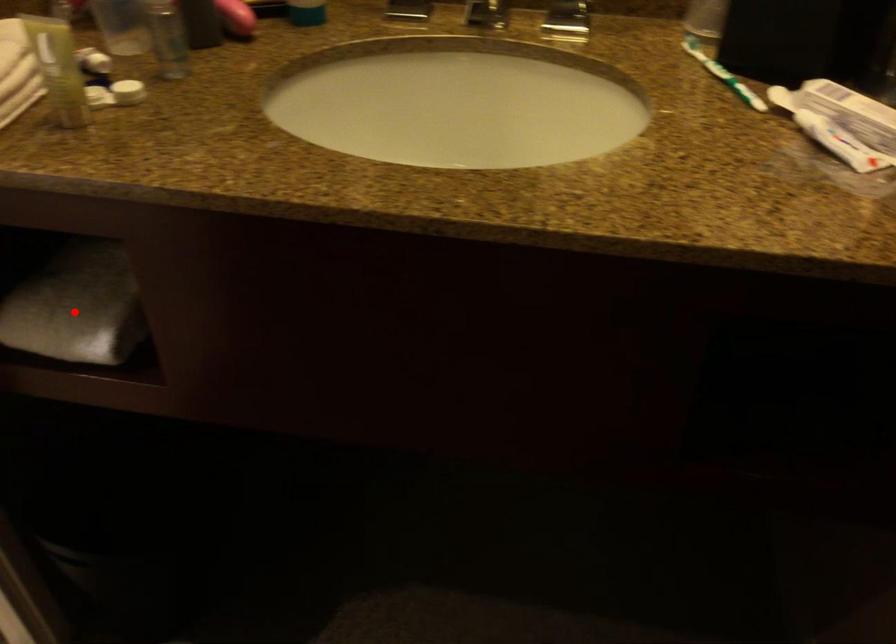
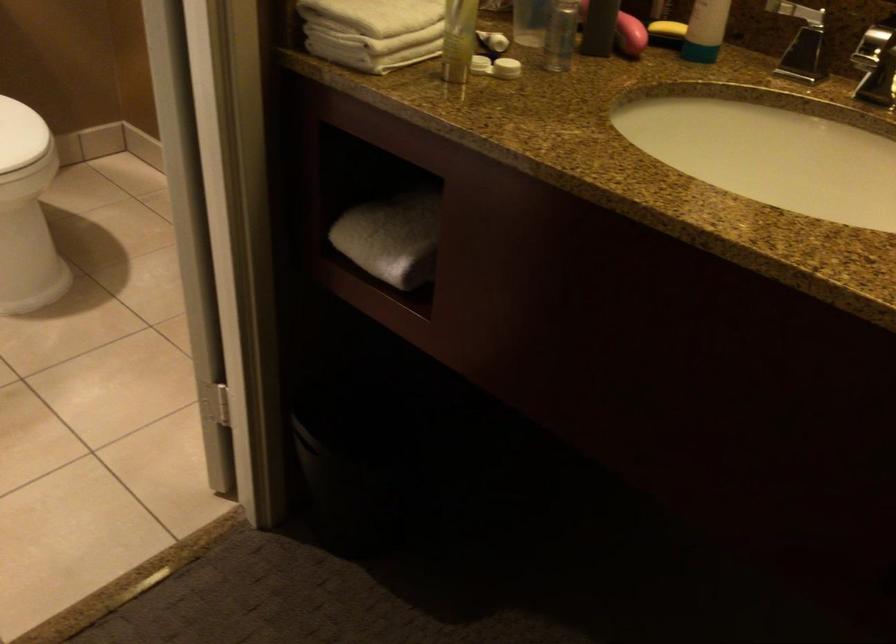
Locate, in the second image, the point that corresponds to the highlighted location in the first image.

(392, 238)